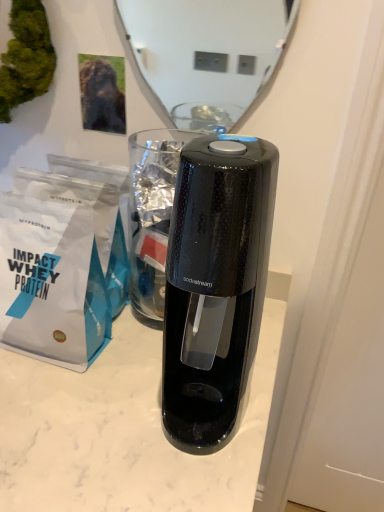
Question: From the image's perspective, is glossy white mirror at upper center beneath white matte paper bag at left?

Choices:
 (A) no
 (B) yes

Answer: (A)

Question: Can you confirm if glossy white mirror at upper center is smaller than white matte paper bag at left?

Choices:
 (A) yes
 (B) no

Answer: (A)

Question: From a real-world perspective, is glossy white mirror at upper center on white matte paper bag at left?

Choices:
 (A) yes
 (B) no

Answer: (A)

Question: Is the surface of glossy white mirror at upper center in direct contact with white matte paper bag at left?

Choices:
 (A) yes
 (B) no

Answer: (B)

Question: Is glossy white mirror at upper center at the right side of white matte paper bag at left?

Choices:
 (A) yes
 (B) no

Answer: (A)

Question: Which is correct: green moss at upper left is inside glossy white mirror at upper center, or outside of it?

Choices:
 (A) inside
 (B) outside

Answer: (B)

Question: From a real-world perspective, is green moss at upper left physically located above or below glossy white mirror at upper center?

Choices:
 (A) below
 (B) above

Answer: (B)

Question: From the image's perspective, relative to glossy white mirror at upper center, is green moss at upper left above or below?

Choices:
 (A) below
 (B) above

Answer: (B)

Question: Is green moss at upper left wider or thinner than glossy white mirror at upper center?

Choices:
 (A) wide
 (B) thin

Answer: (A)

Question: From the image's perspective, is green moss at upper left above or below white matte paper bag at left?

Choices:
 (A) above
 (B) below

Answer: (A)

Question: In the image, is green moss at upper left positioned in front of or behind white matte paper bag at left?

Choices:
 (A) behind
 (B) front

Answer: (A)

Question: Considering the positions of green moss at upper left and white matte paper bag at left in the image, is green moss at upper left bigger or smaller than white matte paper bag at left?

Choices:
 (A) small
 (B) big

Answer: (A)

Question: From a real-world perspective, is green moss at upper left positioned above or below white matte paper bag at left?

Choices:
 (A) below
 (B) above

Answer: (B)

Question: Is white matte paper bag at left inside or outside of green moss at upper left?

Choices:
 (A) inside
 (B) outside

Answer: (B)

Question: Is white matte paper bag at left taller or shorter than green moss at upper left?

Choices:
 (A) tall
 (B) short

Answer: (A)